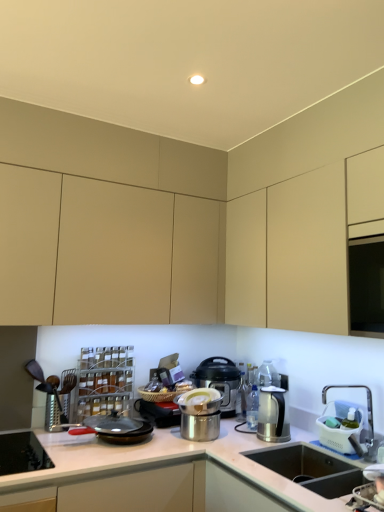
You are a GUI agent. You are given a task and a screenshot of the screen. Output one action in this format:
    pyautogui.click(x=<x>, y=<y>)
    Task: Click on the empty space that is ontop of matte beige cabinet at center, the 1th cabinetry in the front-to-back sequence (from a real-world perspective)
    This screenshot has height=512, width=384.
    Given the screenshot: What is the action you would take?
    tap(190, 77)